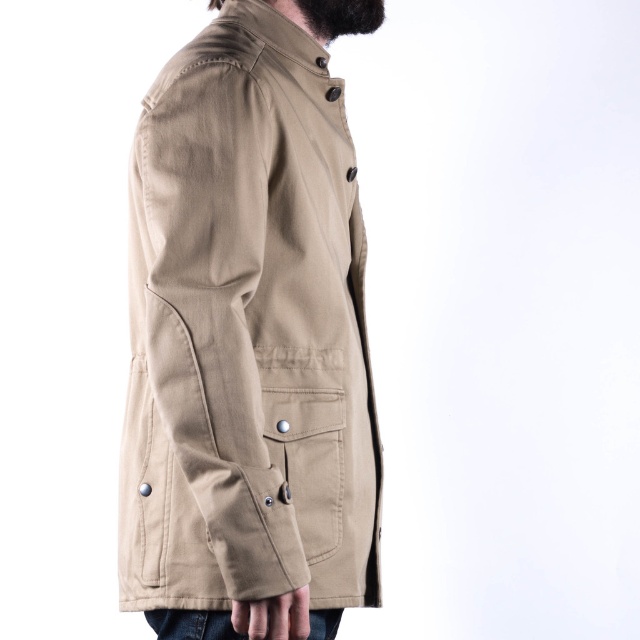
You are a fashion designer reviewing a jacket design. The jacket has a matte khaki pocket at center and a black fuzzy beard at upper center. Which of these two features is bigger in size?

The matte khaki pocket at center is larger in size than the black fuzzy beard at upper center.

You are a fashion designer analyzing the jacket in the image. You need to decide which feature is taller between the matte khaki pocket at center and the black fuzzy beard at upper center. Based on the description, which one is taller?

The matte khaki pocket at center is much taller than the black fuzzy beard at upper center according to the description.